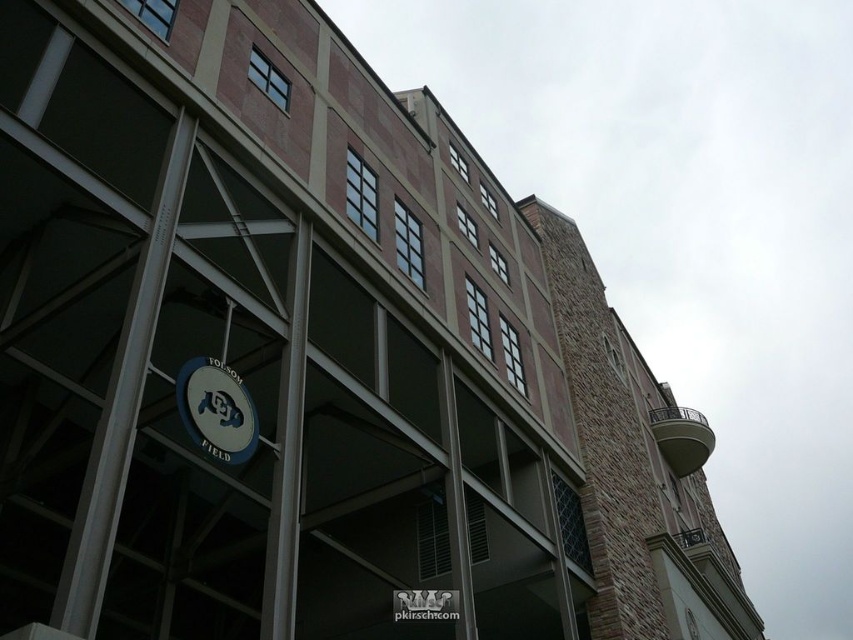
Question: Can you confirm if matte white sign at center-left is wider than matte black sign at center?

Choices:
 (A) no
 (B) yes

Answer: (A)

Question: Which of the following is the farthest from the observer?

Choices:
 (A) (410, 608)
 (B) (201, 388)

Answer: (A)

Question: Which of the following is the closest to the observer?

Choices:
 (A) matte black sign at center
 (B) matte white sign at center-left

Answer: (B)

Question: Is matte white sign at center-left above matte black sign at center?

Choices:
 (A) yes
 (B) no

Answer: (A)

Question: Is matte white sign at center-left above matte black sign at center?

Choices:
 (A) no
 (B) yes

Answer: (B)